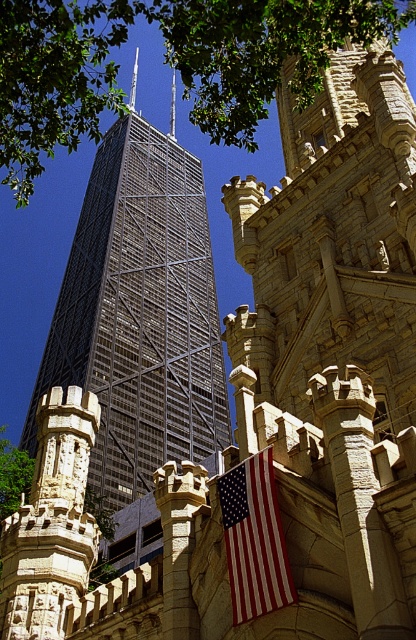
Question: Estimate the real-world distances between objects in this image. Which object is farther from the green leafy tree at lower left?

Choices:
 (A) red-white striped fabric at center
 (B) green leafy tree at upper left

Answer: (B)

Question: Which is nearer to the metallic glass skyscraper at center?

Choices:
 (A) green leafy tree at lower left
 (B) smooth silver spire at center
 (C) red-white striped fabric at center

Answer: (A)

Question: Which point appears closest to the camera in this image?

Choices:
 (A) (98, 180)
 (B) (269, 554)
 (C) (135, 93)

Answer: (B)

Question: Is red-white striped fabric at center closer to the viewer compared to smooth silver spire at center?

Choices:
 (A) yes
 (B) no

Answer: (A)

Question: Does green leafy tree at upper left have a greater width compared to green leafy tree at lower left?

Choices:
 (A) no
 (B) yes

Answer: (B)

Question: Is metallic glass skyscraper at center behind red-white striped fabric at center?

Choices:
 (A) no
 (B) yes

Answer: (B)